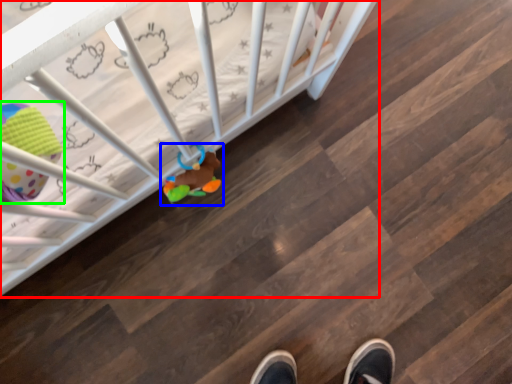
Question: Which object is positioned closest to infant bed (highlighted by a red box)? Select from toy (highlighted by a blue box) and toy (highlighted by a green box).

Choices:
 (A) toy
 (B) toy

Answer: (A)